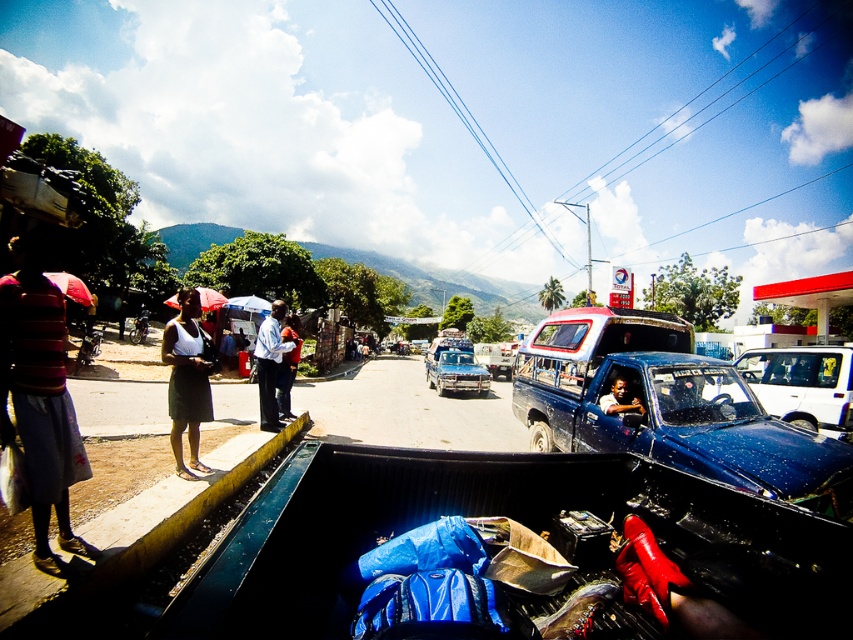
You are standing in the street scene and want to reach a point that is exactly 4.73 meters away from you. According to the image, is the point at coordinates point (172, 346) within that distance?

The distance of point (172, 346) from viewer is 4.73 meters, so yes, the point at coordinates point (172, 346) is exactly 4.73 meters away from you.

You are standing on the street and see the light blue shirt at center and the matte blue truck at center. If you walk straight ahead, which object will you encounter first?

You will encounter the light blue shirt at center first because it is closer to you than the matte blue truck at center.

You are standing in the street scene and want to take a photo of both point (271, 403) and point (614, 403) in the image. Which point should you focus on first to ensure both are in focus?

You should focus on point (271, 403) first because it is closer to the camera than point (614, 403). By focusing on the closer point, the depth of field may also cover the farther point, ensuring both are in focus.